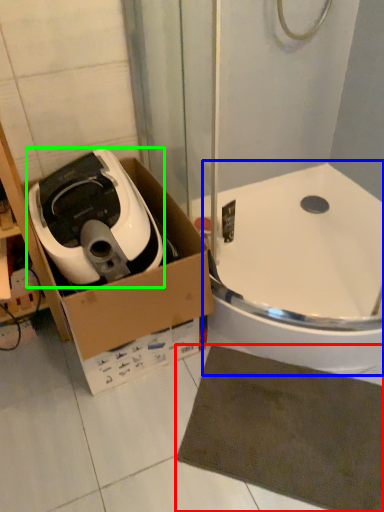
Question: Which is farther away from bath mat (highlighted by a red box)? bath (highlighted by a blue box) or home appliance (highlighted by a green box)?

Choices:
 (A) bath
 (B) home appliance

Answer: (B)